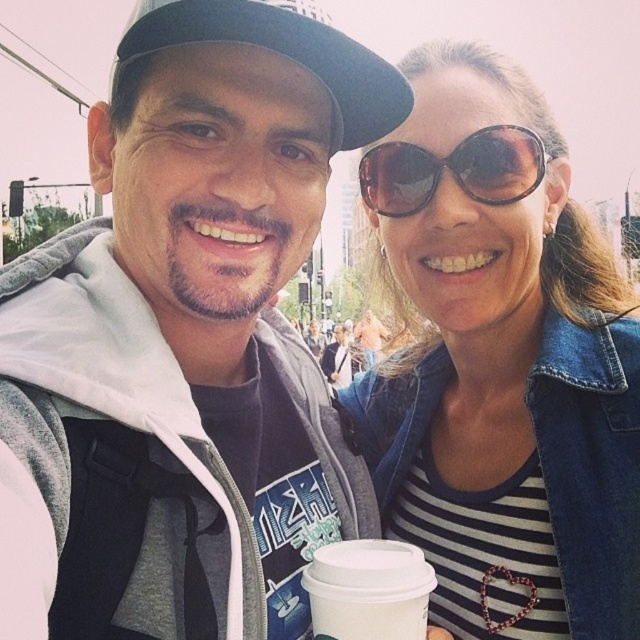
You are a photographer trying to capture a clear shot of both the matte gray hoodie at center and the sunglasses at center. Given that your camera has a depth of field that can sharply focus on objects within a 1.5 meter range, will both items be in focus simultaneously?

The matte gray hoodie at center is 1.88 meters away from sunglasses at center. Since the distance between them exceeds the camera lens depth of field range of 1.5 meters, both items cannot be in focus at the same time.

You are a photographer standing at the camera position. You want to take a closeup shot of the white paper cup at center without moving the camera. Is it possible to focus on the cup while keeping both people in the frame?

The white paper cup at center is 3.22 meters away from the camera. Since the cup is within a typical focusing range and the scene includes both people, it should be possible to focus on the cup while keeping both individuals in the frame.

Based on the photo, you are a photographer trying to capture a clear shot of both the matte gray hoodie at center and the white paper cup at center in the image. Since the background is blurred, which object should you focus on to ensure it appears sharp and in focus?

The matte gray hoodie at center is much taller than the white paper cup at center, so focusing on the taller matte gray hoodie at center would ensure it appears sharp while the smaller cup might still be in focus due to its proximity.